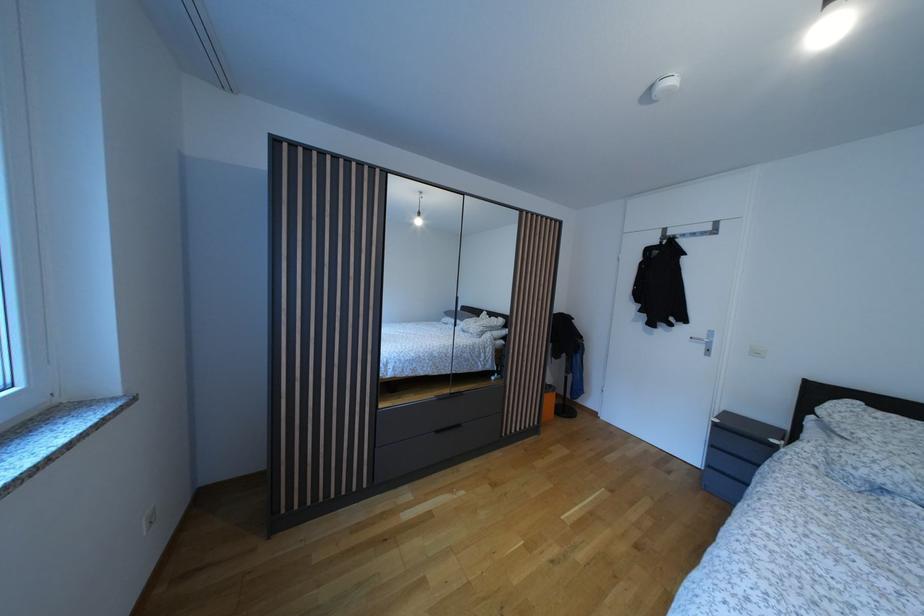
You are a GUI agent. You are given a task and a screenshot of the screen. Output one action in this format:
    pyautogui.click(x=<x>, y=<y>)
    Task: Click on the silver door handle
    
    Given the screenshot: What is the action you would take?
    pyautogui.click(x=700, y=339)